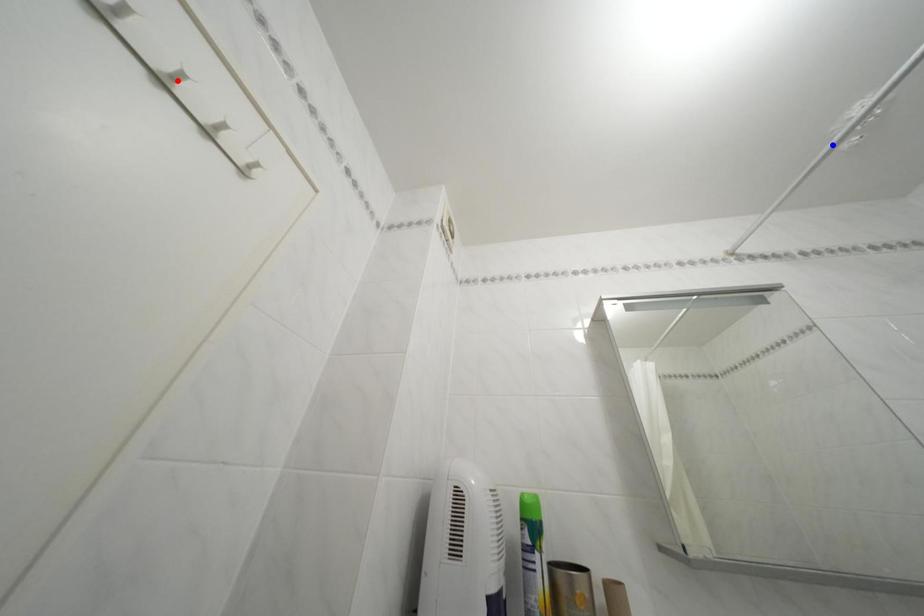
Question: In the image, two points are highlighted. Which point is nearer to the camera? Reply with the corresponding letter.

Choices:
 (A) blue point
 (B) red point

Answer: (B)